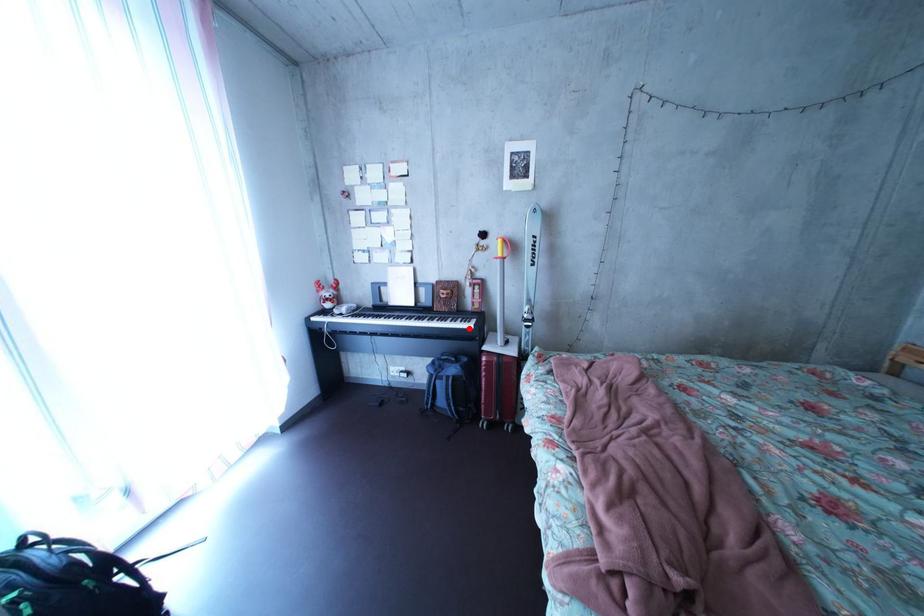
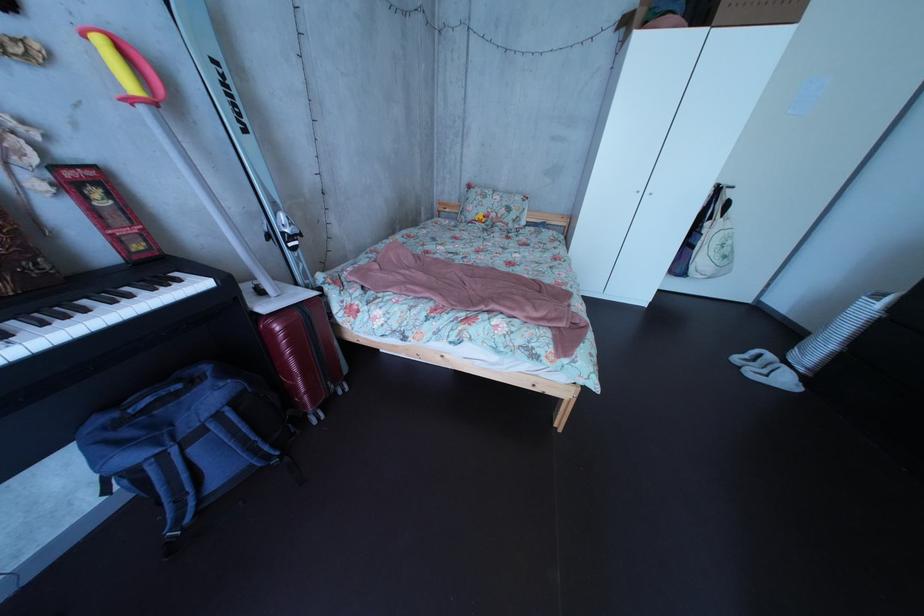
In the second image, find the point that corresponds to the highlighted location in the first image.

(128, 305)